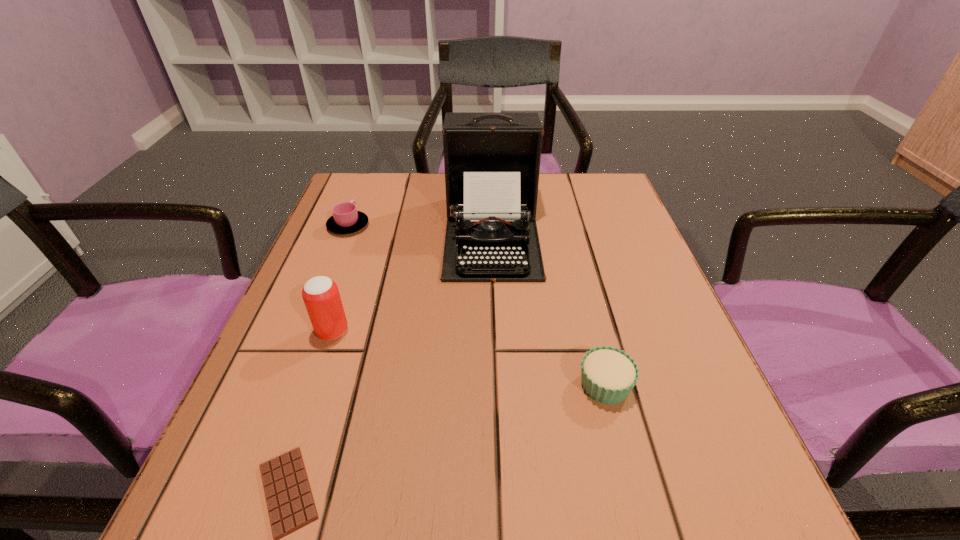
Find the location of a particular element. the fourth closest object to the second nearest object is located at coordinates click(x=346, y=219).

I want to click on vacant space that satisfies the following two spatial constraints: 1. on the front side of the cupcake; 2. on the right side of the third nearest object, so click(314, 384).

The image size is (960, 540). Identify the location of vacant area that satisfies the following two spatial constraints: 1. on the front side of the cupcake; 2. on the left side of the beer can. (314, 384).

I want to click on free space that satisfies the following two spatial constraints: 1. inside the open case of the fourth object from left to right; 2. on the right side of the cupcake, so click(x=497, y=384).

This screenshot has height=540, width=960. Find the location of `vacant space that satisfies the following two spatial constraints: 1. inside the open case of the second object from right to left; 2. on the right side of the cupcake`. vacant space that satisfies the following two spatial constraints: 1. inside the open case of the second object from right to left; 2. on the right side of the cupcake is located at coordinates (497, 384).